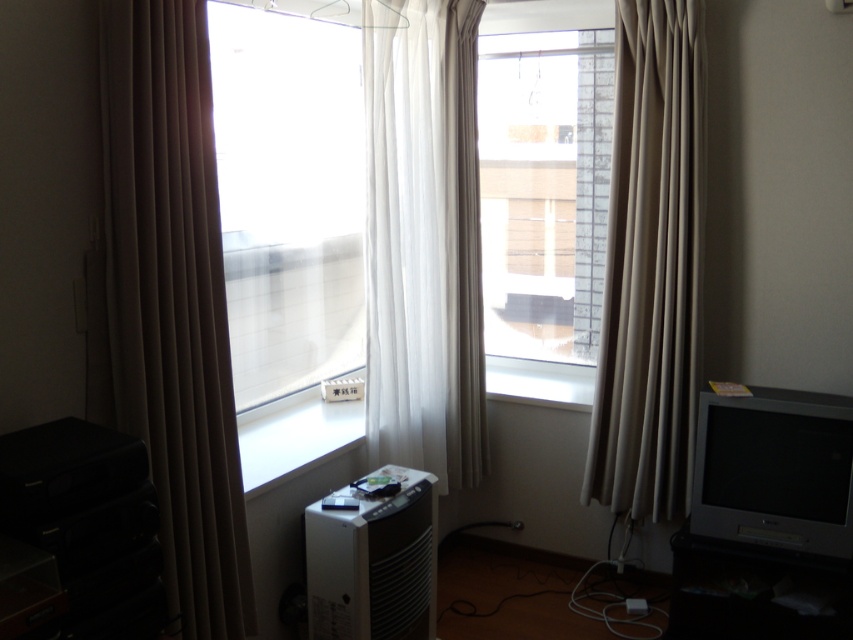
You are trying to decide which window to open to let in more natural light. Based on the curtains described, which window should you choose between the beige fabric curtain at left and the beige fabric curtain at right?

The beige fabric curtain at left is thinner than the beige fabric curtain at right, so opening the window with the beige fabric curtain at left would allow more natural light to enter.

From the picture: What is the object located at the coordinates point (422, 237) in the image?

The point (422, 237) marks the white sheer curtain at center.